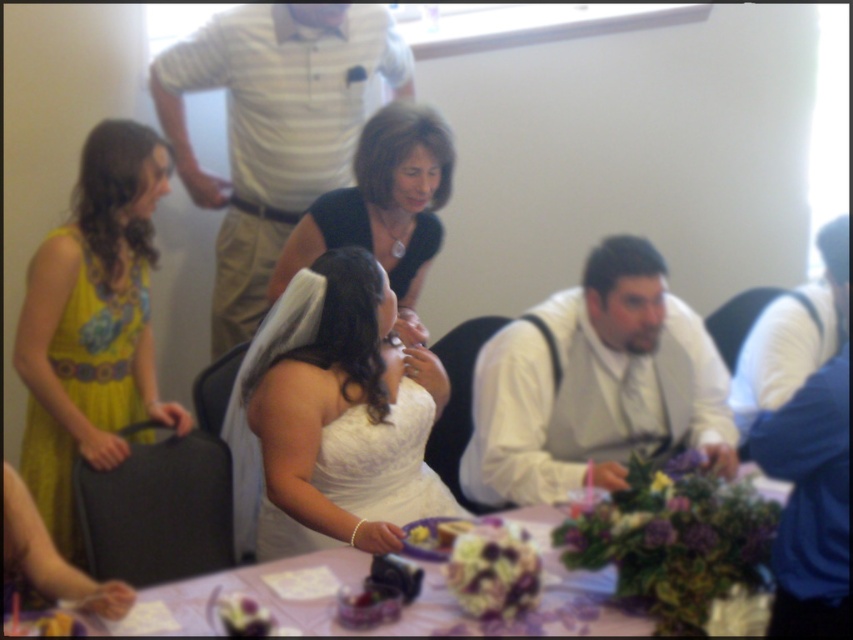
Question: Among these objects, which one is nearest to the camera?

Choices:
 (A) blue satin vest at right
 (B) black matte dress at upper center
 (C) white satin vest at center
 (D) white shirt at upper center

Answer: (C)

Question: Does white shirt at upper center have a lesser width compared to black matte dress at upper center?

Choices:
 (A) yes
 (B) no

Answer: (B)

Question: Does white shirt at upper center have a larger size compared to yellow floral fabric dress at left?

Choices:
 (A) no
 (B) yes

Answer: (B)

Question: Which of the following is the closest to the observer?

Choices:
 (A) blue satin vest at right
 (B) white satin dress at center
 (C) white satin vest at center

Answer: (C)

Question: Which of the following is the closest to the observer?

Choices:
 (A) yellow floral fabric dress at left
 (B) white satin dress at center
 (C) white shirt at upper center

Answer: (B)

Question: Can you confirm if white lace tablecloth at center is wider than white satin dress at center?

Choices:
 (A) yes
 (B) no

Answer: (A)